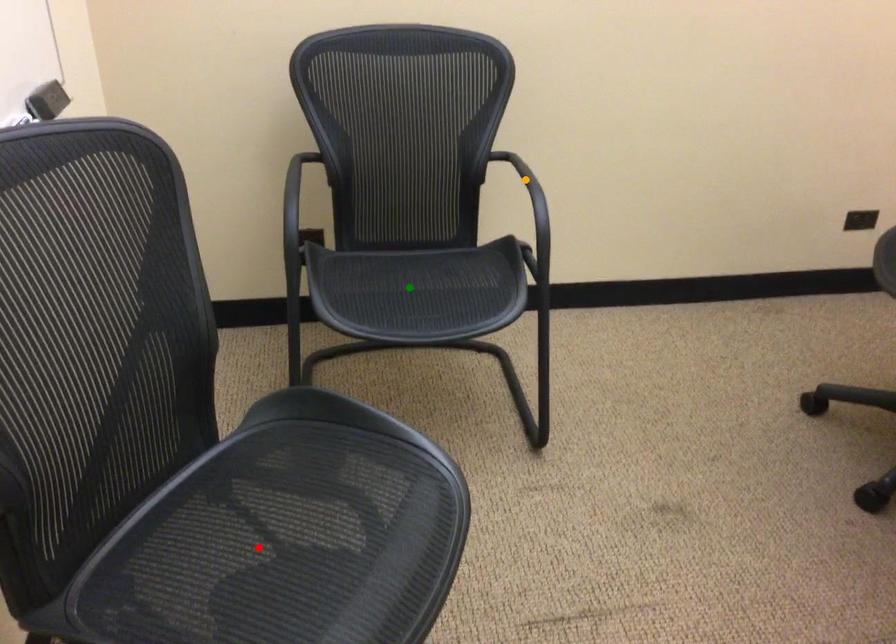
Order these from nearest to farthest:
orange point | green point | red point

red point < green point < orange point